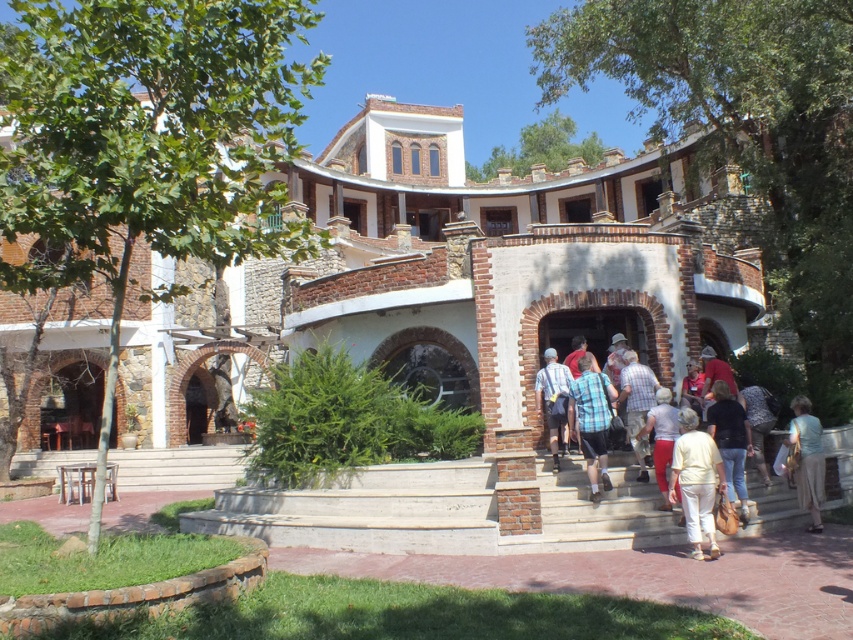
Question: Which of the following is the closest to the observer?

Choices:
 (A) light blue fabric at lower right
 (B) plaid fabric shirt at center

Answer: (A)

Question: Is light beige cotton shirt at center to the left of light blue fabric at lower right from the viewer's perspective?

Choices:
 (A) no
 (B) yes

Answer: (B)

Question: Is concrete stairs at center bigger than patterned fabric bag at lower right?

Choices:
 (A) no
 (B) yes

Answer: (B)

Question: Does light beige pants at center appear on the right side of light brown leather jacket at center?

Choices:
 (A) no
 (B) yes

Answer: (A)

Question: Which of these objects is positioned closest to the plaid fabric shirt at center?

Choices:
 (A) light beige pants at center
 (B) light blue fabric at lower right

Answer: (A)

Question: Based on their relative distances, which object is nearer to the light beige pants at center?

Choices:
 (A) light blue fabric at lower right
 (B) plaid fabric shirt at center
 (C) white stone stairs at lower left
 (D) striped shirt at center

Answer: (B)